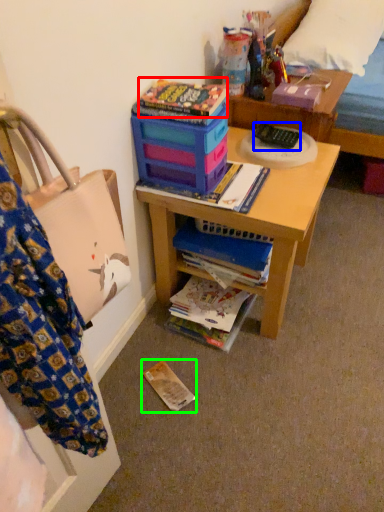
Question: Which object is positioned farthest from paperback book (highlighted by a red box)? Select from remote control (highlighted by a blue box) and paperback book (highlighted by a green box).

Choices:
 (A) remote control
 (B) paperback book

Answer: (B)